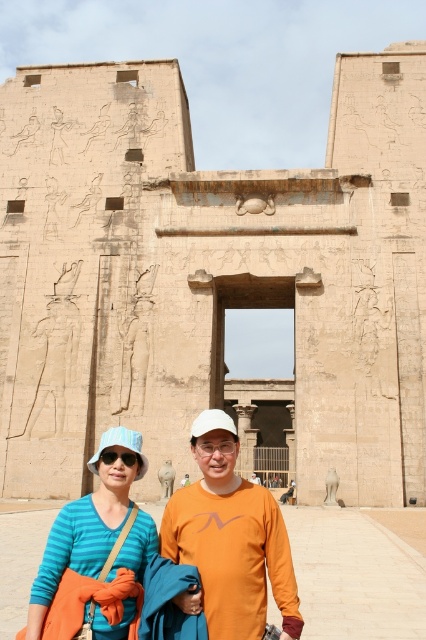
You are a tourist standing in front of the beige stone temple at center and the orange matte shirt at center. Which object is positioned to the left?

The beige stone temple at center is positioned to the left of the orange matte shirt at center.

You are an archaeologist visiting the Edfu Temple. You notice the beige stone temple at center and the blue striped shirt at center in the image. Which object is bigger in size?

The beige stone temple at center is larger in size than the blue striped shirt at center.